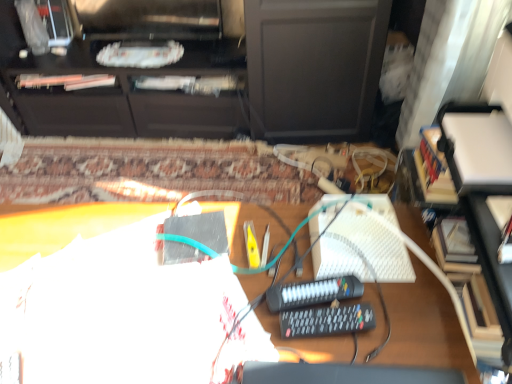
In order to click on unoccupied space behind black plastic remote control at center, which is counted as the 2th equipment, starting from the back in this screenshot , I will do `click(287, 255)`.